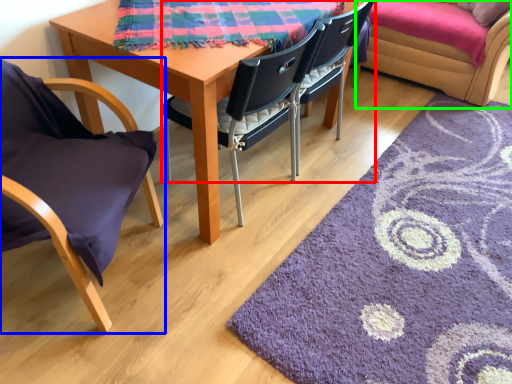
Question: Based on their relative distances, which object is nearer to chair (highlighted by a red box)? Choose from chair (highlighted by a blue box) and couch (highlighted by a green box).

Choices:
 (A) chair
 (B) couch

Answer: (A)